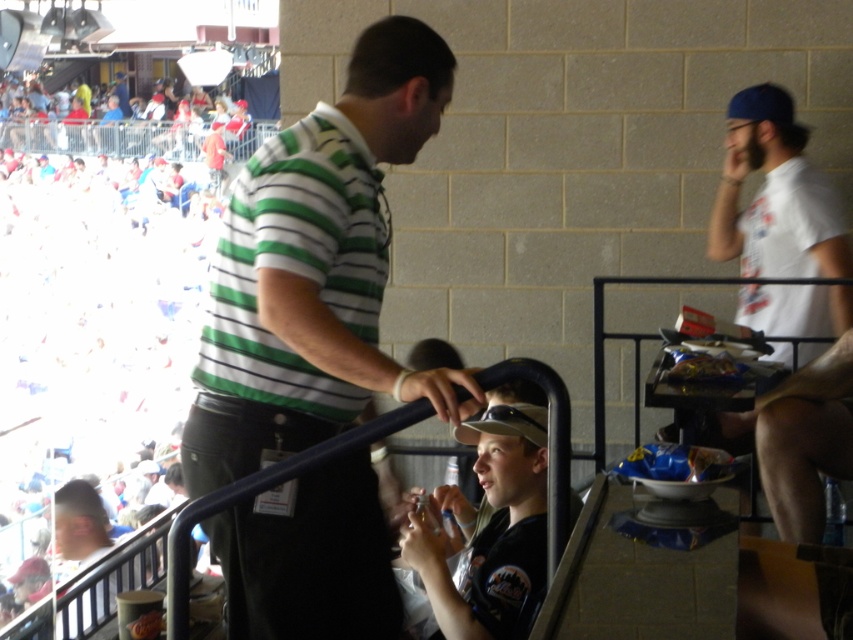
Consider the image. You are a photographer at the baseball stadium. You want to take a photo of the green striped shirt at center and the white plastic cups at upper left. Which object should you focus on first if you want to capture both in the same frame without moving the camera?

The green striped shirt at center has a lesser height compared to white plastic cups at upper left, so you should focus on the white plastic cups at upper left first to ensure both are in the frame.

You are standing at the point labeled as point (299, 392) in the baseball stadium. A friend is at your location and wants to throw a ball to you. If they can throw the ball up to 10 feet, will they be able to reach you?

The distance between point (299, 392) and the viewer is 8.01 feet. Since the friend can throw up to 10 feet, they can successfully reach you with the throw.